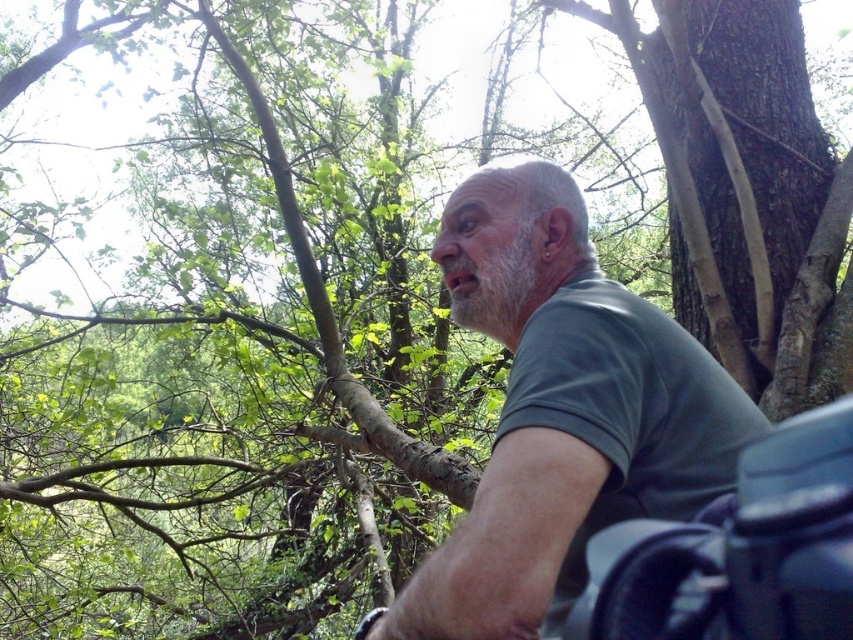
Looking at this image, who is shorter, green matte shirt at center or black rubber motorcycle at lower right?

black rubber motorcycle at lower right

Consider the image. Can you confirm if green matte shirt at center is bigger than black rubber motorcycle at lower right?

Correct, green matte shirt at center is larger in size than black rubber motorcycle at lower right.

Does point (514, 516) come closer to viewer compared to point (572, 627)?

Yes, point (514, 516) is in front of point (572, 627).

Where is `green matte shirt at center`? This screenshot has height=640, width=853. green matte shirt at center is located at coordinates (561, 413).